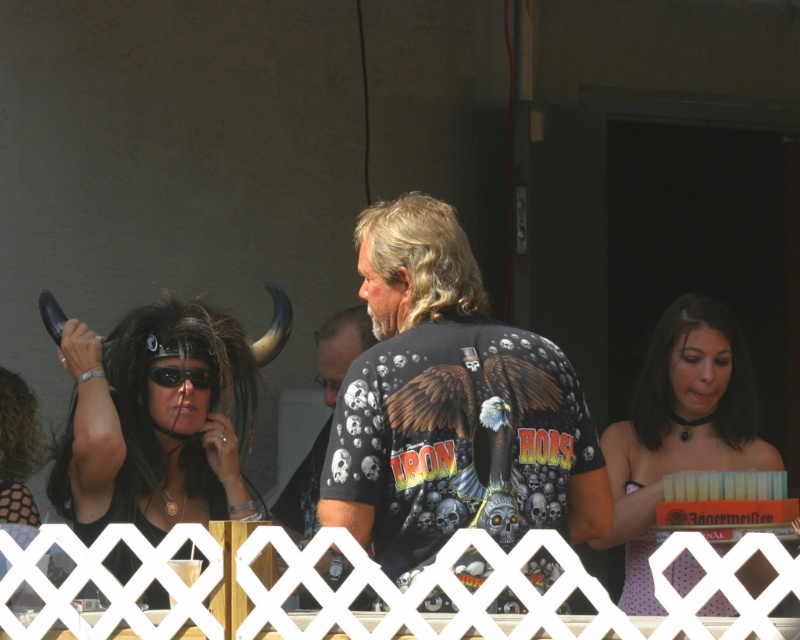
Question: Is golden blonde hair at center positioned behind black t-shirt with skulls at center?

Choices:
 (A) no
 (B) yes

Answer: (A)

Question: Which object is positioned farthest from the golden blonde hair at center?

Choices:
 (A) curly dark brown hair at lower left
 (B) polka dot fabric at lower left
 (C) blondehair at center
 (D) black smooth hair at center

Answer: (D)

Question: Which of the following is the farthest from the observer?

Choices:
 (A) blondehair at center
 (B) black smooth hair at center

Answer: (A)

Question: Which object appears farthest from the camera in this image?

Choices:
 (A) black matte t-shirt with eagle design at center
 (B) white lattice fence at lower center
 (C) matte black hair at center

Answer: (C)

Question: Does black smooth hair at center come behind polka dot fabric at lower left?

Choices:
 (A) no
 (B) yes

Answer: (B)

Question: In this image, where is polka dot fabric at lower left located relative to black matte goggles at upper center?

Choices:
 (A) left
 (B) right

Answer: (A)